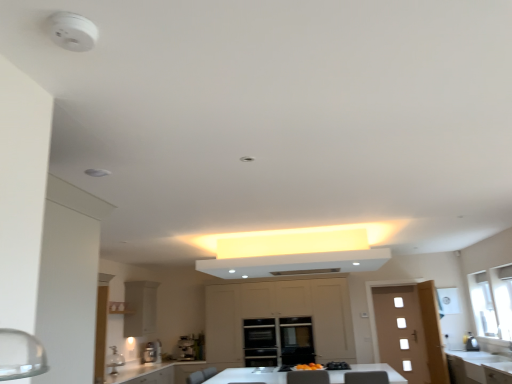
Question: Would you consider satin silver coffee machine at center, acting as the 1th coffee machine starting from the left, to be distant from wooden door at right?

Choices:
 (A) yes
 (B) no

Answer: (A)

Question: Is satin silver coffee machine at center, acting as the 1th coffee machine starting from the left, completely or partially outside of wooden door at right?

Choices:
 (A) no
 (B) yes

Answer: (B)

Question: Does satin silver coffee machine at center, placed as the second coffee machine when sorted from right to left, have a larger size compared to wooden door at right?

Choices:
 (A) yes
 (B) no

Answer: (B)

Question: Is satin silver coffee machine at center, placed as the second coffee machine when sorted from right to left, at the left side of wooden door at right?

Choices:
 (A) no
 (B) yes

Answer: (B)

Question: From a real-world perspective, is satin silver coffee machine at center, placed as the second coffee machine when sorted from right to left, below wooden door at right?

Choices:
 (A) no
 (B) yes

Answer: (A)

Question: From the image's perspective, is satin silver coffee machine at center, acting as the 1th coffee machine starting from the left, on top of wooden door at right?

Choices:
 (A) no
 (B) yes

Answer: (B)

Question: Does satin silver coffee machine at center, placed as the second coffee machine when sorted from right to left, have a smaller size compared to matte beige cabinetry at center, which is the 1th cabinetry from right to left?

Choices:
 (A) no
 (B) yes

Answer: (B)

Question: Can you confirm if satin silver coffee machine at center, acting as the 1th coffee machine starting from the left, is wider than matte beige cabinetry at center, which is the 1th cabinetry from right to left?

Choices:
 (A) no
 (B) yes

Answer: (A)

Question: Does satin silver coffee machine at center, acting as the 1th coffee machine starting from the left, have a larger size compared to matte beige cabinetry at center, the 2th cabinetry in the left-to-right sequence?

Choices:
 (A) yes
 (B) no

Answer: (B)

Question: Can you confirm if satin silver coffee machine at center, placed as the second coffee machine when sorted from right to left, is taller than matte beige cabinetry at center, which is the 1th cabinetry from right to left?

Choices:
 (A) yes
 (B) no

Answer: (B)

Question: Is satin silver coffee machine at center, placed as the second coffee machine when sorted from right to left, far away from matte beige cabinetry at center, the 2th cabinetry in the left-to-right sequence?

Choices:
 (A) yes
 (B) no

Answer: (A)

Question: Is satin silver coffee machine at center, placed as the second coffee machine when sorted from right to left, facing away from matte beige cabinetry at center, the 2th cabinetry in the left-to-right sequence?

Choices:
 (A) no
 (B) yes

Answer: (A)

Question: Is satin silver coffee machine at lower center, acting as the 1th coffee machine starting from the right, shorter than satin silver coffee machine at center, acting as the 1th coffee machine starting from the left?

Choices:
 (A) yes
 (B) no

Answer: (A)